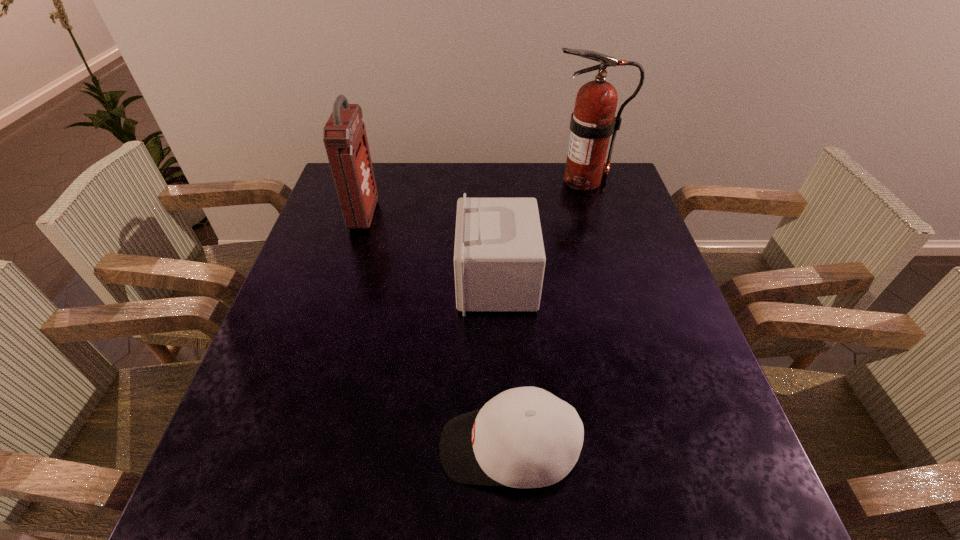
Locate an element on the screen. This screenshot has height=540, width=960. object that is at the near edge is located at coordinates (525, 437).

Identify the location of object that is at the left edge. The image size is (960, 540). (344, 135).

You are a GUI agent. You are given a task and a screenshot of the screen. Output one action in this format:
    pyautogui.click(x=<x>, y=<y>)
    Task: Click on the object present at the right edge
    
    Given the screenshot: What is the action you would take?
    pyautogui.click(x=593, y=121)

Where is `object at the far left corner`? The image size is (960, 540). object at the far left corner is located at coordinates (344, 135).

Identify the location of object that is at the far right corner. This screenshot has width=960, height=540. (593, 121).

Where is `blank space at the far edge of the desktop`? blank space at the far edge of the desktop is located at coordinates (398, 178).

The height and width of the screenshot is (540, 960). Identify the location of free space at the left edge of the desktop. (300, 453).

This screenshot has width=960, height=540. In order to click on blank space at the right edge in this screenshot , I will do `click(675, 321)`.

This screenshot has width=960, height=540. In order to click on free space at the near left corner in this screenshot , I will do `click(291, 524)`.

The height and width of the screenshot is (540, 960). I want to click on blank region between the nearest object and the fire extinguisher, so click(546, 314).